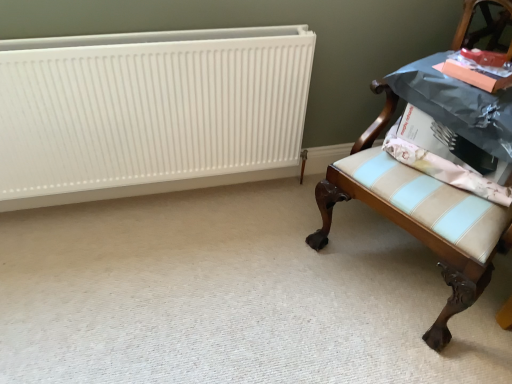
Identify the location of vacant area that lies between white matte radiator at upper left and wooden upholstered chair at right. (221, 254).